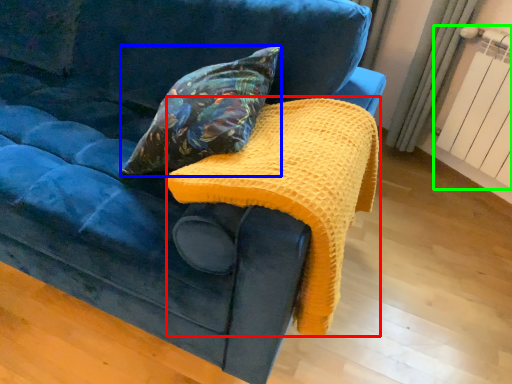
Question: Which is farther away from blanket (highlighted by a red box)? pillow (highlighted by a blue box) or radiator (highlighted by a green box)?

Choices:
 (A) pillow
 (B) radiator

Answer: (B)